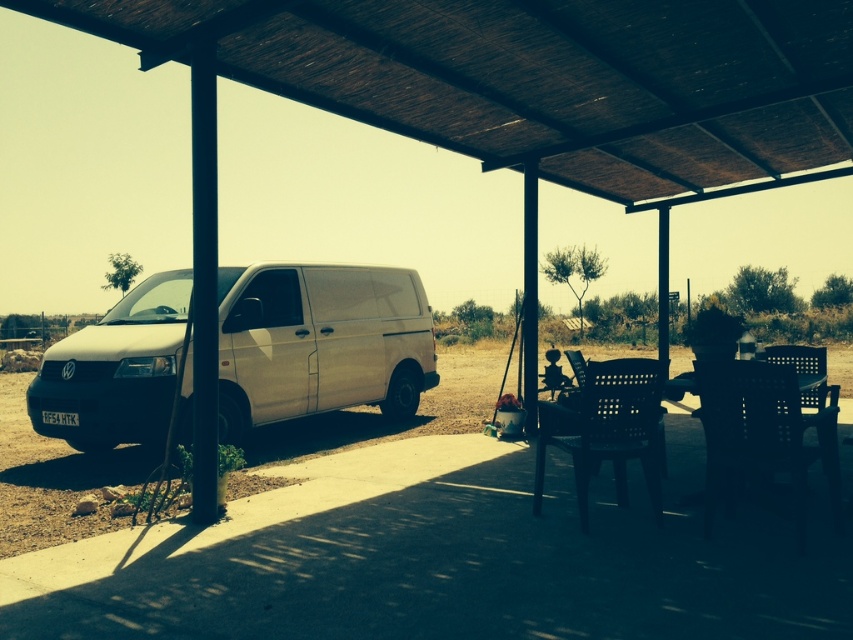
Is the position of dirt field at lower left less distant than that of black plastic picnic table at lower right?

No, it is behind black plastic picnic table at lower right.

Who is lower down, dirt field at lower left or black plastic picnic table at lower right?

Positioned lower is dirt field at lower left.

Who is more distant from viewer, (x=27, y=381) or (x=595, y=364)?

Point (x=27, y=381)

Image resolution: width=853 pixels, height=640 pixels. Find the location of `dirt field at lower left`. dirt field at lower left is located at coordinates (51, 480).

The image size is (853, 640). I want to click on black plastic picnic table at lower right, so click(607, 428).

Which is behind, point (642, 381) or point (828, 497)?

The point (642, 381) is more distant.

Is point (811, 374) in front of point (811, 449)?

No, it is behind (811, 449).

Find the location of a particular element. Image resolution: width=853 pixels, height=640 pixels. black plastic picnic table at lower right is located at coordinates (607, 428).

Which is below, white matte van at left or dirt field at lower left?

dirt field at lower left is below.

Does white matte van at left have a smaller size compared to dirt field at lower left?

Correct, white matte van at left occupies less space than dirt field at lower left.

Does point (372, 324) lie behind point (430, 404)?

That is False.

The height and width of the screenshot is (640, 853). Find the location of `white matte van at left`. white matte van at left is located at coordinates (318, 342).